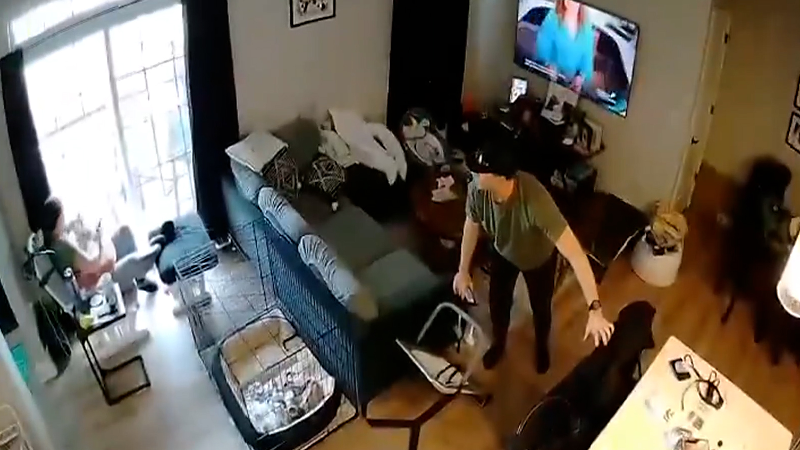
Find the location of a particular element. This screenshot has width=800, height=450. floor is located at coordinates (712, 335).